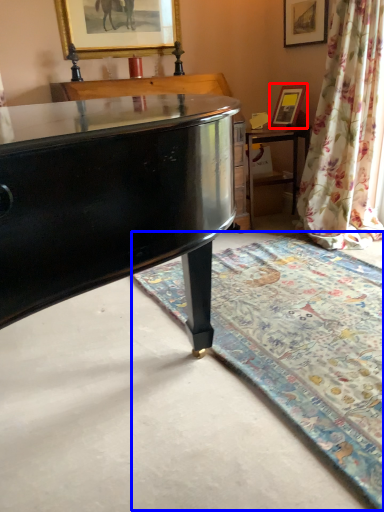
Question: Which object is further to the camera taking this photo, picture frame (highlighted by a red box) or mat (highlighted by a blue box)?

Choices:
 (A) picture frame
 (B) mat

Answer: (A)